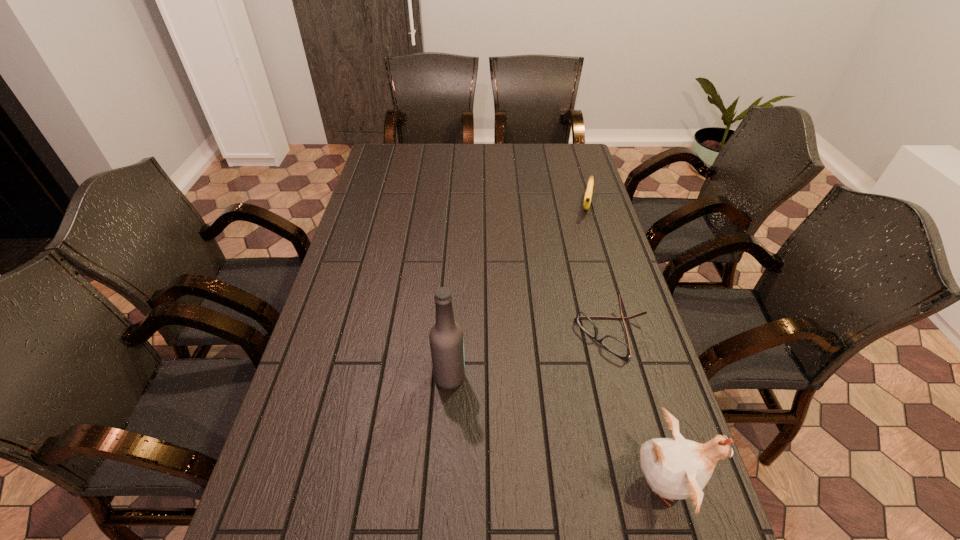
This screenshot has width=960, height=540. Find the location of `vacant space located 0.090m at the stem of the farthest object`. vacant space located 0.090m at the stem of the farthest object is located at coordinates (587, 234).

At what (x,y) coordinates should I click in order to perform the action: click on free space located 0.070m at the stem of the farthest object. Please return your answer as a coordinate pair (x, y). Image resolution: width=960 pixels, height=540 pixels. Looking at the image, I should click on (587, 231).

In order to click on vacant area located at the stem of the farthest object in this screenshot , I will do `click(585, 247)`.

Image resolution: width=960 pixels, height=540 pixels. What are the coordinates of `spectacles present at the right edge` in the screenshot? It's located at (613, 344).

You are a GUI agent. You are given a task and a screenshot of the screen. Output one action in this format:
    pyautogui.click(x=<x>, y=<y>)
    Task: Click on the banana at the right edge
    This screenshot has width=960, height=540.
    Given the screenshot: What is the action you would take?
    pyautogui.click(x=588, y=194)

In the image, there is a desktop. Where is `blank space at the far edge`? This screenshot has height=540, width=960. blank space at the far edge is located at coordinates (518, 155).

The width and height of the screenshot is (960, 540). In the image, there is a desktop. In order to click on vacant space at the near edge in this screenshot , I will do `click(503, 537)`.

The width and height of the screenshot is (960, 540). In the image, there is a desktop. Identify the location of vacant region at the left edge. (399, 180).

At what (x,y) coordinates should I click in order to perform the action: click on free space at the right edge of the desktop. Please return your answer as a coordinate pair (x, y). This screenshot has height=540, width=960. Looking at the image, I should click on (571, 207).

Find the location of a particular element. This screenshot has height=540, width=960. free spot between the farthest object and the spectacles is located at coordinates (599, 269).